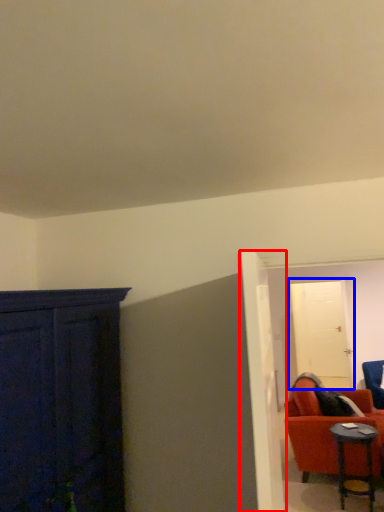
Question: Which object appears closest to the camera in this image, door (highlighted by a red box) or door (highlighted by a blue box)?

Choices:
 (A) door
 (B) door

Answer: (A)